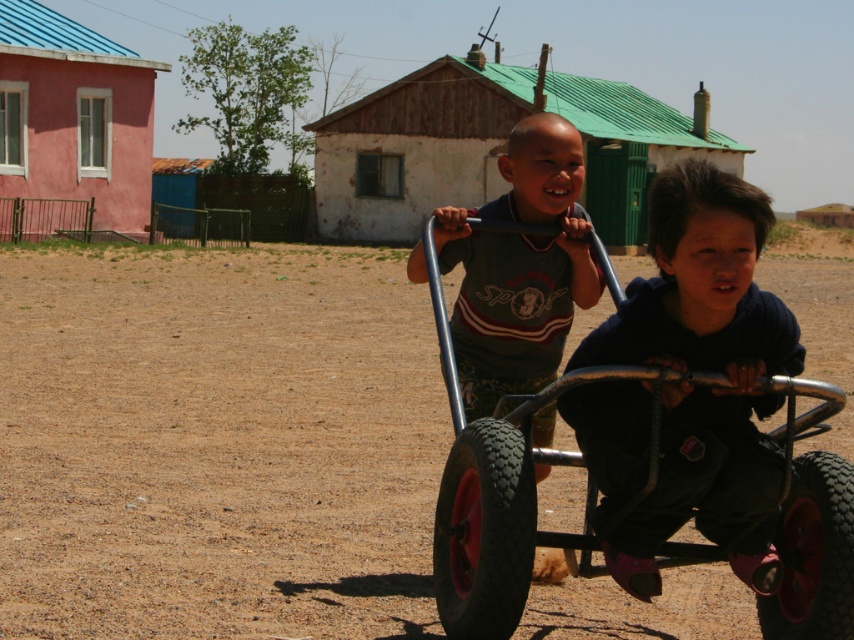
Between point (553, 396) and point (133, 141), which one is positioned in front?

Point (553, 396) is in front.

Is metallic matte tricycle at center wider than pink stucco house at left?

In fact, metallic matte tricycle at center might be narrower than pink stucco house at left.

Describe the element at coordinates (501, 492) in the screenshot. I see `metallic matte tricycle at center` at that location.

You are a GUI agent. You are given a task and a screenshot of the screen. Output one action in this format:
    pyautogui.click(x=<x>, y=<y>)
    Task: Click on the metallic matte tricycle at center
    The image size is (854, 640).
    Given the screenshot: What is the action you would take?
    pyautogui.click(x=501, y=492)

Is white painted wood hut at center smaller than matte gray shirt at center?

No.

Which is more to the right, white painted wood hut at center or matte gray shirt at center?

white painted wood hut at center

Which is behind, point (422, 200) or point (576, 246)?

Positioned behind is point (422, 200).

The image size is (854, 640). What are the coordinates of `white painted wood hut at center` in the screenshot? It's located at (x=416, y=147).

Can you confirm if metallic matte tricycle at center is positioned to the left of white painted wood hut at center?

Yes, metallic matte tricycle at center is to the left of white painted wood hut at center.

This screenshot has height=640, width=854. What do you see at coordinates (501, 492) in the screenshot?
I see `metallic matte tricycle at center` at bounding box center [501, 492].

Is point (449, 358) less distant than point (402, 88)?

Yes, point (449, 358) is closer to viewer.

Image resolution: width=854 pixels, height=640 pixels. I want to click on metallic matte tricycle at center, so click(x=501, y=492).